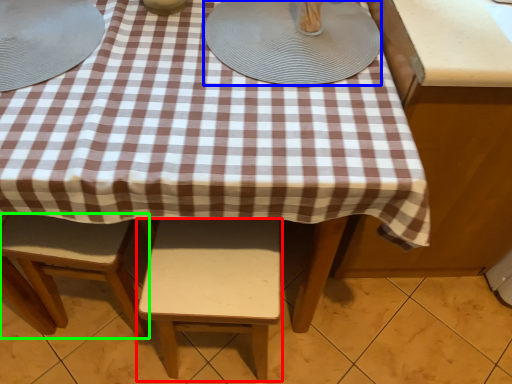
Question: Which is nearer to the stool (highlighted by a red box)? platter (highlighted by a blue box) or stool (highlighted by a green box).

Choices:
 (A) platter
 (B) stool

Answer: (B)